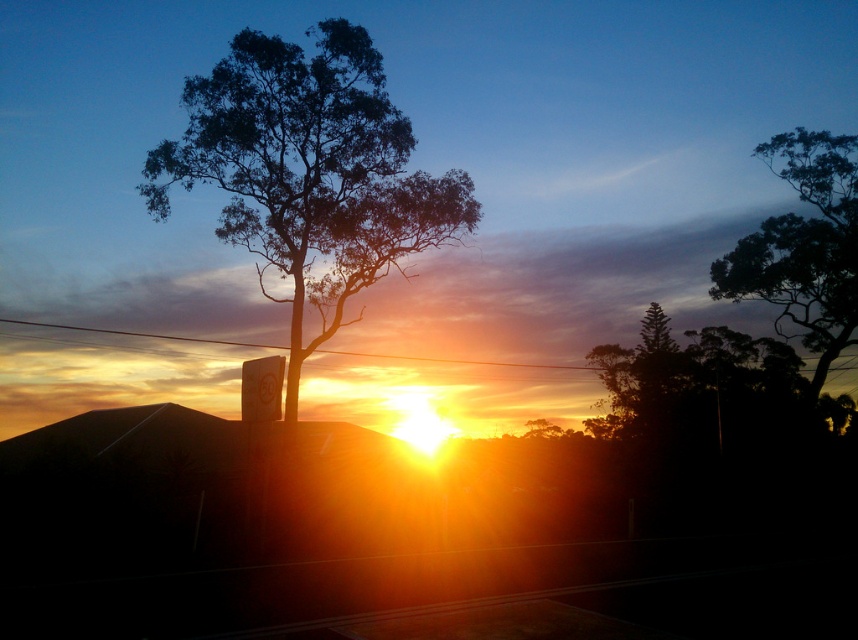
Question: Which point appears farthest from the camera in this image?

Choices:
 (A) (805, 173)
 (B) (234, 124)

Answer: (A)

Question: Among these points, which one is farthest from the camera?

Choices:
 (A) (807, 132)
 (B) (276, 256)

Answer: (A)

Question: Is dark green leafy tree at center below dark green leafy tree at upper right?

Choices:
 (A) yes
 (B) no

Answer: (B)

Question: Can you confirm if dark green leafy tree at center is smaller than dark green leafy tree at upper right?

Choices:
 (A) yes
 (B) no

Answer: (B)

Question: Is dark green leafy tree at center thinner than dark green leafy tree at upper right?

Choices:
 (A) yes
 (B) no

Answer: (B)

Question: Which point appears closest to the camera in this image?

Choices:
 (A) (850, 134)
 (B) (339, 236)

Answer: (B)